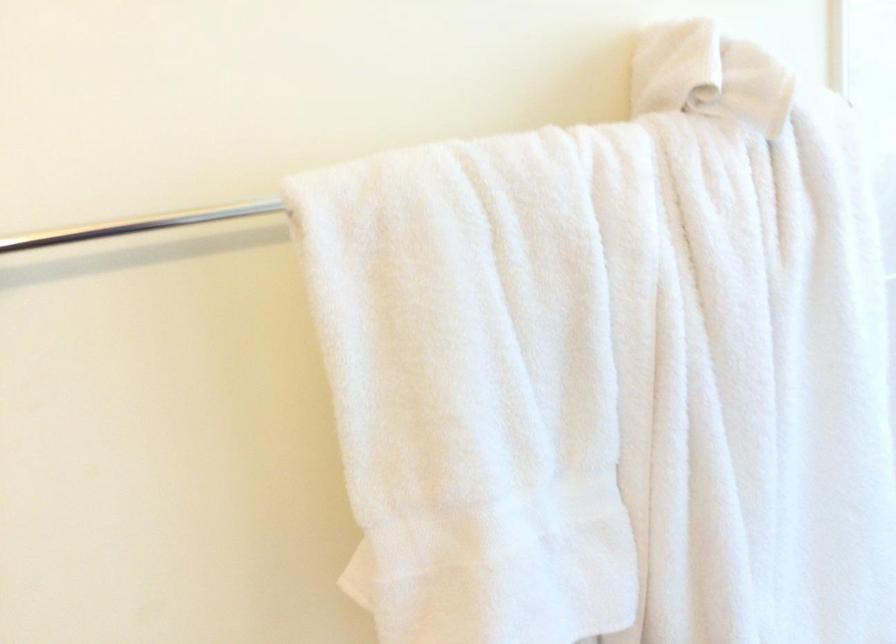
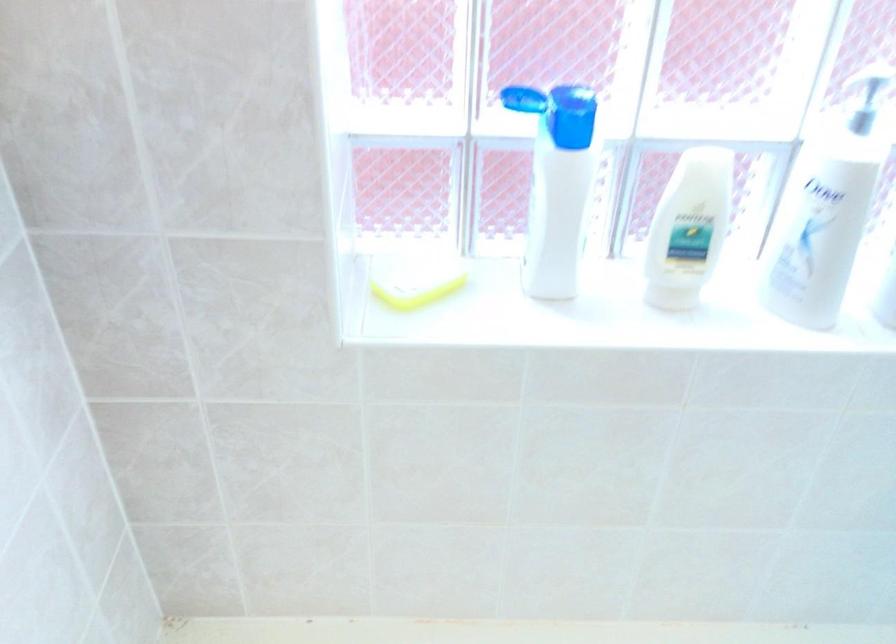
The images are taken continuously from a first-person perspective. In which direction is your viewpoint rotating?

The rotation direction of the camera is right-down.